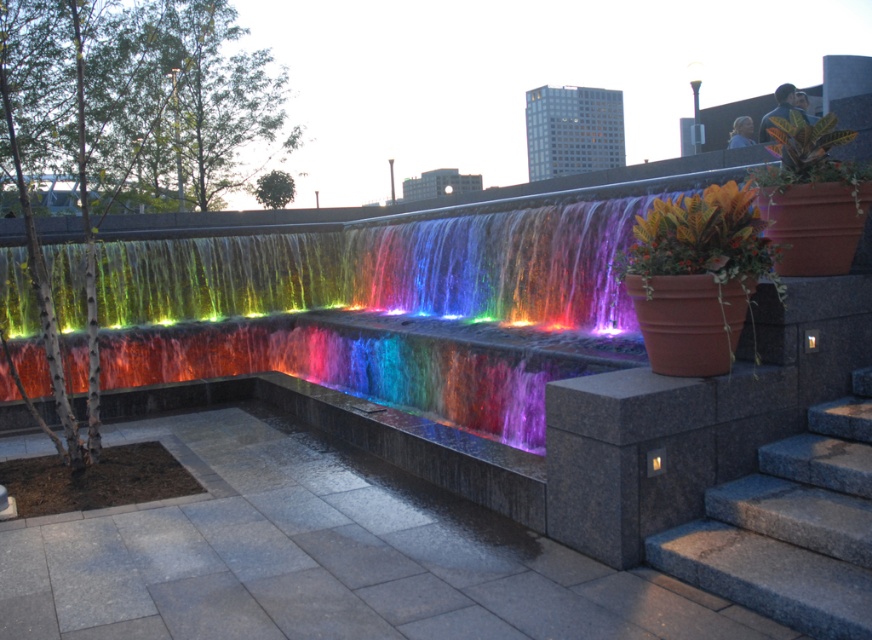
Question: Where is terracotta pot at right located in relation to green glossy leafy plant at upper right in the image?

Choices:
 (A) above
 (B) below

Answer: (B)

Question: Which point is farther to the camera?

Choices:
 (A) (740, 269)
 (B) (855, 476)

Answer: (A)

Question: In this image, where is granite steps at lower right located relative to green glossy leafy plant at upper right?

Choices:
 (A) right
 (B) left

Answer: (B)

Question: Which of the following is the closest to the observer?

Choices:
 (A) (842, 177)
 (B) (697, 241)
 (C) (801, 508)

Answer: (C)

Question: Which point is closer to the camera taking this photo?

Choices:
 (A) (823, 131)
 (B) (746, 205)

Answer: (B)

Question: Is terracotta pot at right to the right of green glossy leafy plant at upper right from the viewer's perspective?

Choices:
 (A) yes
 (B) no

Answer: (B)